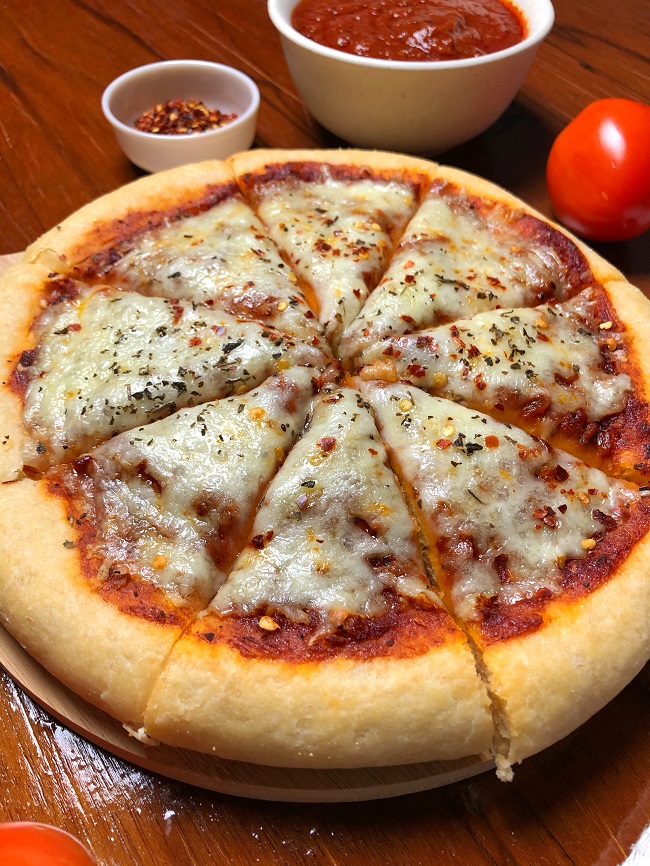
This screenshot has height=866, width=650. Find the location of `tray`. tray is located at coordinates (404, 792).